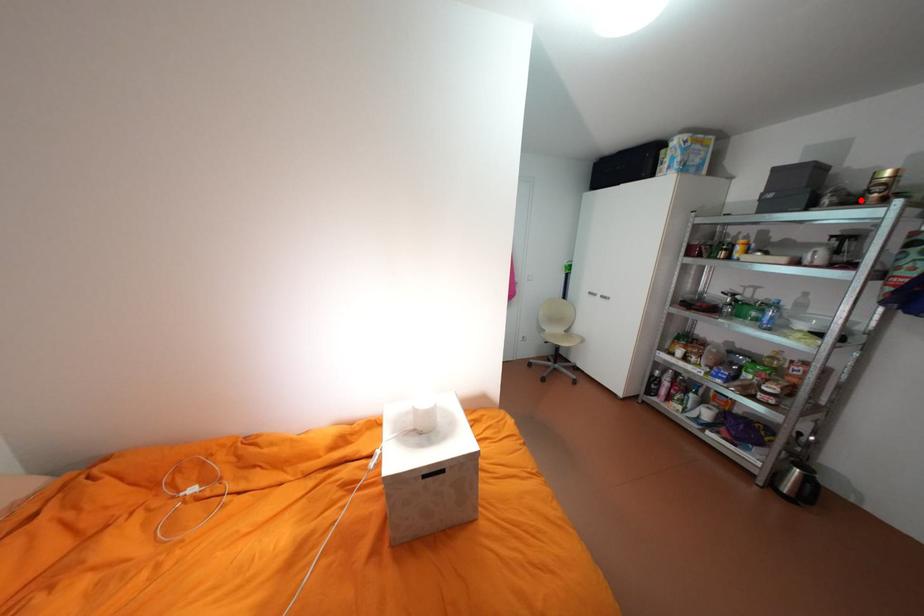
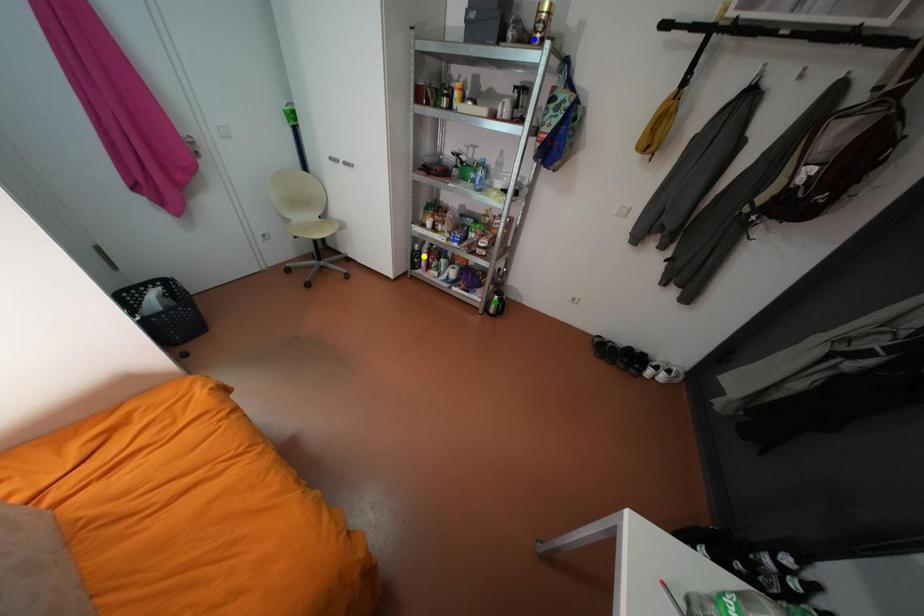
Question: I am providing you with two images of the same scene from different viewpoints. A red point is marked on the first image. You are given multiple points on the second image. Which point in image 2 is actually the same real-world point as the red point in image 1?

Choices:
 (A) blue point
 (B) green point
 (C) yellow point

Answer: (A)